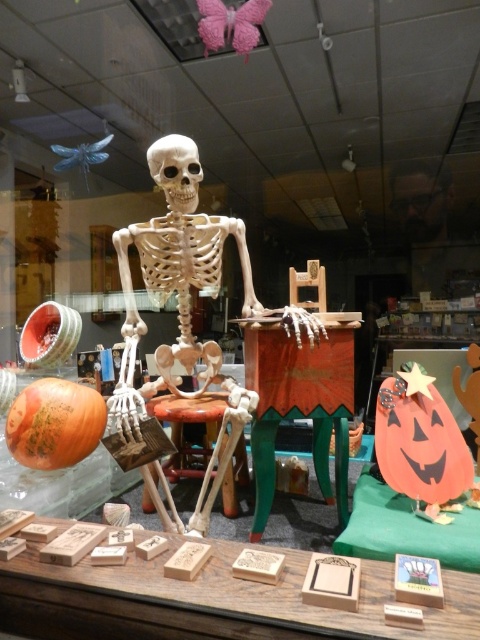
Is bearded man at upper center below wooden stool at center?

Incorrect, bearded man at upper center is not positioned below wooden stool at center.

Between point (440, 278) and point (226, 477), which one is positioned in front?

Point (226, 477)

Where is `bearded man at upper center`? bearded man at upper center is located at coordinates (430, 227).

Is smooth beige skull at center to the left of wooden stool at center from the viewer's perspective?

Yes, smooth beige skull at center is to the left of wooden stool at center.

Does point (184, 172) come closer to viewer compared to point (216, 397)?

Yes.

You are a GUI agent. You are given a task and a screenshot of the screen. Output one action in this format:
    pyautogui.click(x=<x>, y=<y>)
    Task: Click on the smooth beige skull at center
    This screenshot has height=640, width=480.
    Given the screenshot: What is the action you would take?
    pyautogui.click(x=176, y=170)

Is white bone skeleton at center in front of smooth beige skull at center?

Yes, it is in front of smooth beige skull at center.

Does point (219, 285) come in front of point (191, 186)?

No, it is not.

This screenshot has height=640, width=480. I want to click on white bone skeleton at center, so click(x=179, y=324).